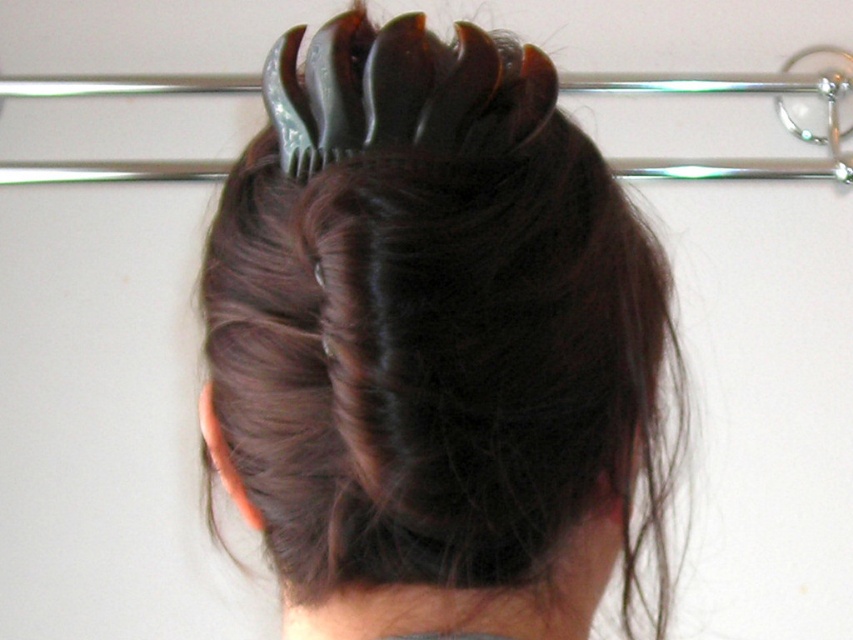
Based on the photo, you are standing in a room and see a person with a bun and a metallic object in the background. You want to reach a point that is exactly 20 inches away from you. Is the point at coordinates point (292, 154) within reach?

The distance of point (292, 154) from viewer is 19.51 inches, so yes, the point at coordinates point (292, 154) is within reach since it is less than 20 inches away.

You are a stylist observing the person with their hair in a bun. You notice two clips holding it in place. Which clip is bigger between the dark brown glossy hair clip at center and the black plastic hair clip at upper center?

The dark brown glossy hair clip at center is larger in size than the black plastic hair clip at upper center.

You are standing in a room and see two points marked on the wall. The first point is at coordinates point (x=405, y=268), and the second is at point (x=753, y=177). Which point is closer to you?

Point (x=405, y=268) is closer to the camera than point (x=753, y=177), so the first point is closer to you.